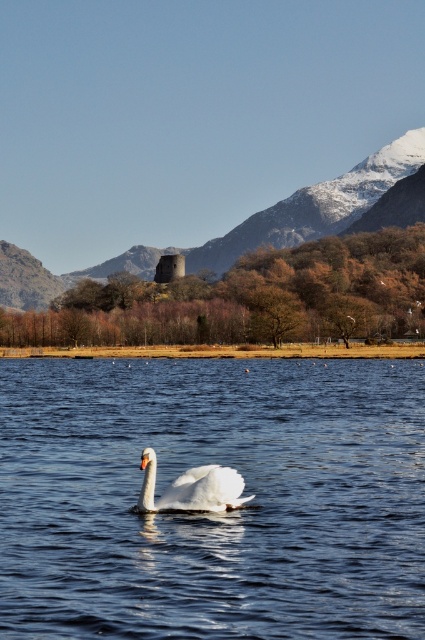
You are an artist planning to paint this landscape. You need to decide which area to focus on more based on their sizes. Which object from the scene should you emphasize more in your painting, the clear blue water at center or the smooth stone tower at center?

The smooth stone tower at center should be emphasized more in the painting because it occupies more space than the clear blue water at center according to the description.

You are a birdwatcher observing the scene. You notice the smooth stone tower at center and the white glossy swan at center. Which object is bigger in size?

The smooth stone tower at center is larger in size compared to the white glossy swan at center.

You are an artist trying to sketch the scene. The clear blue water at center is crucial for the composition. Where should you place it on your canvas to match the original image?

The clear blue water at center should be placed at the 2D coordinate point of (212, 513) on the canvas to accurately reflect its position in the original image.